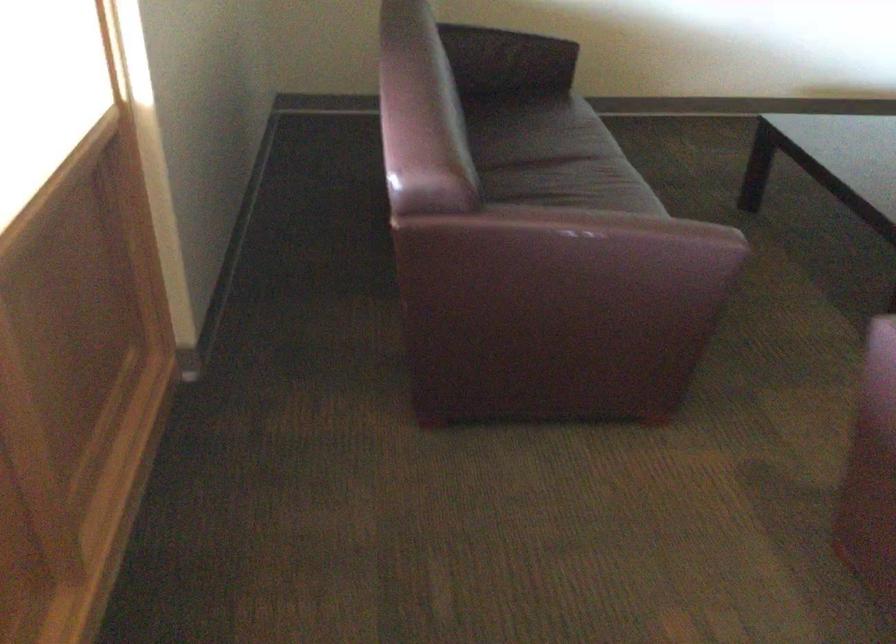
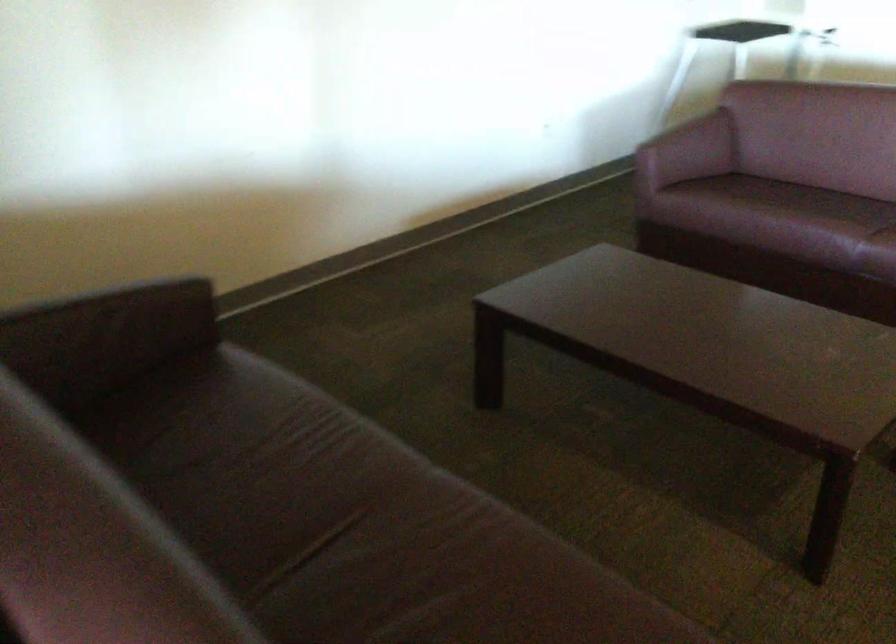
The first image is from the beginning of the video and the second image is from the end. How did the camera likely rotate when shooting the video?

The camera's rotation is toward right-down.